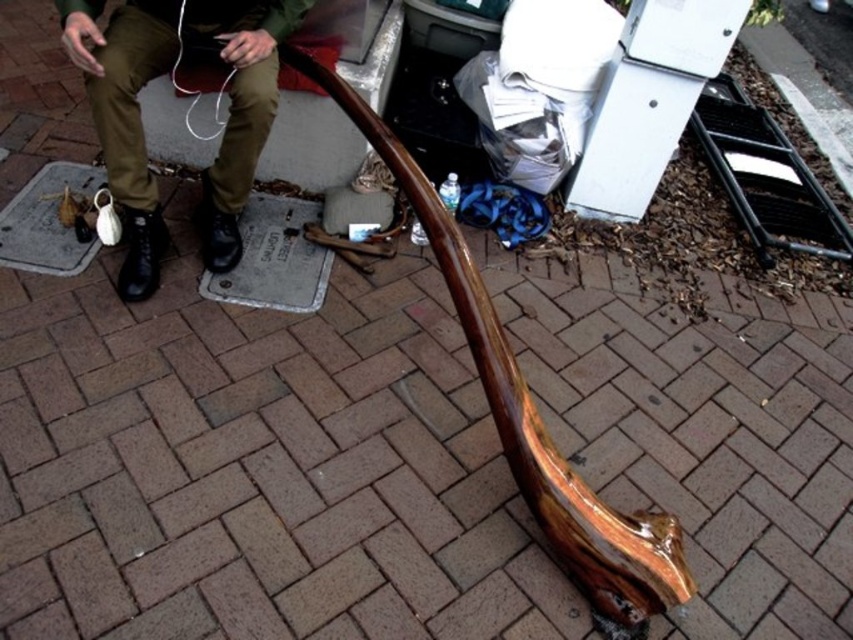
Who is more forward, [639,522] or [142,227]?

Point [639,522]

Is point (669, 576) farther from camera compared to point (256, 144)?

No.

Who is more forward, (401, 148) or (128, 202)?

Point (401, 148) is in front.

The image size is (853, 640). Find the location of `glossy wood sculpture at center`. glossy wood sculpture at center is located at coordinates (531, 419).